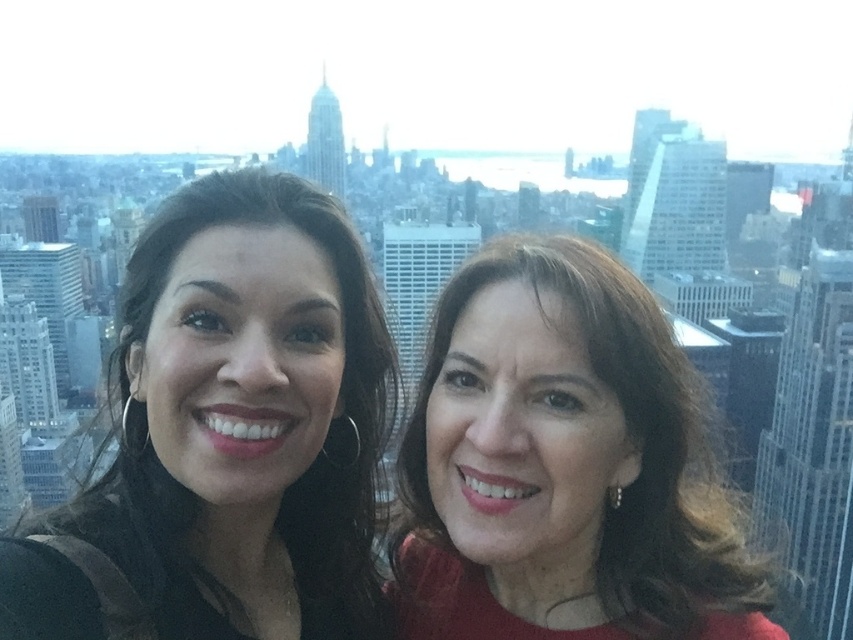
Question: Which of the following is the farthest from the observer?

Choices:
 (A) matte black hair at center
 (B) matte red dress at center

Answer: (B)

Question: Which point is farther from the camera taking this photo?

Choices:
 (A) (219, 550)
 (B) (585, 608)

Answer: (A)

Question: In this image, where is matte black hair at center located relative to matte red dress at center?

Choices:
 (A) above
 (B) below

Answer: (A)

Question: Where is matte black hair at center located in relation to matte red dress at center in the image?

Choices:
 (A) left
 (B) right

Answer: (A)

Question: Does matte black hair at center come behind matte red dress at center?

Choices:
 (A) no
 (B) yes

Answer: (A)